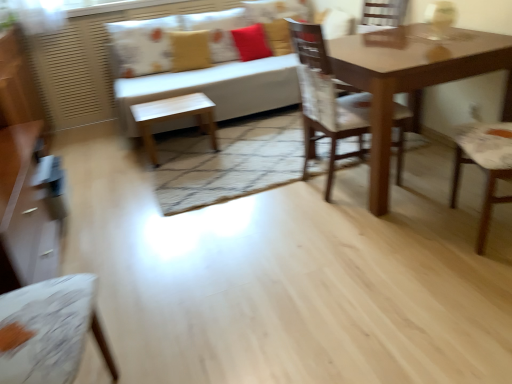
The height and width of the screenshot is (384, 512). Find the location of `free space in front of wooden chair at center`. free space in front of wooden chair at center is located at coordinates (362, 221).